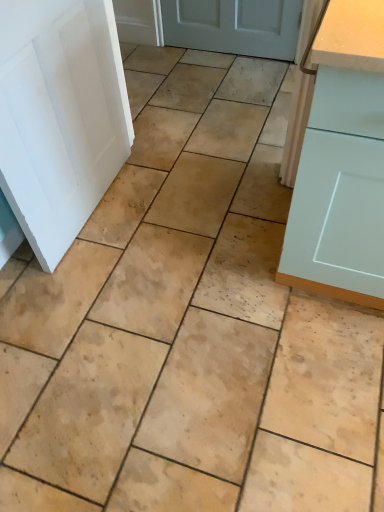
This screenshot has height=512, width=384. Find the location of `vacant area to the left of light blue matte cabinet at right`. vacant area to the left of light blue matte cabinet at right is located at coordinates (211, 261).